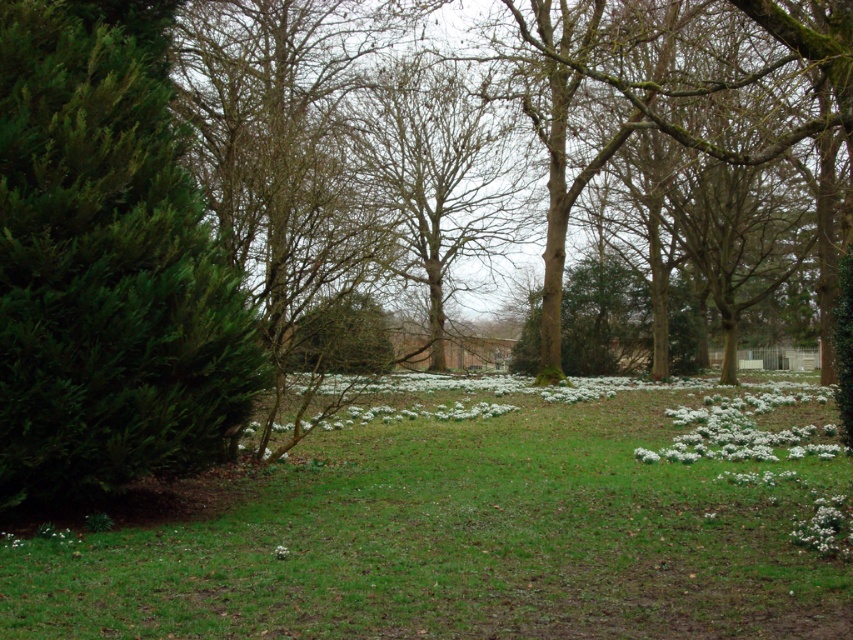
Between green needle-like at left and white matte flowers at lower right, which one is positioned higher?

Positioned higher is green needle-like at left.

Is green needle-like at left in front of white matte flowers at lower right?

Yes, green needle-like at left is closer to the viewer.

Find the location of a particular element. The height and width of the screenshot is (640, 853). green needle-like at left is located at coordinates (105, 272).

Locate an element on the screen. green needle-like at left is located at coordinates (105, 272).

Can you confirm if white matte flowers at lower right is bigger than white matte flower at lower right?

Yes.

Which is behind, point (711, 440) or point (849, 520)?

Point (711, 440)

Between point (648, 452) and point (834, 536), which one is positioned in front?

Point (834, 536) is more forward.

You are a GUI agent. You are given a task and a screenshot of the screen. Output one action in this format:
    pyautogui.click(x=<x>, y=<y>)
    Task: Click on the white matte flowers at lower right
    The image size is (853, 640).
    Given the screenshot: What is the action you would take?
    pyautogui.click(x=741, y=429)

Does green needle-like at left appear on the left side of white matte flower at lower right?

Yes, green needle-like at left is to the left of white matte flower at lower right.

Who is more forward, (86, 344) or (828, 513)?

Point (86, 344) is more forward.

Which is behind, point (178, 275) or point (848, 529)?

Point (178, 275)

This screenshot has width=853, height=640. I want to click on green needle-like at left, so click(105, 272).